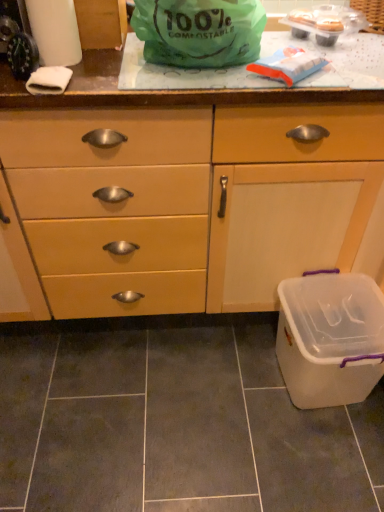
The width and height of the screenshot is (384, 512). In order to click on white paper towel at upper left in this screenshot , I will do `click(55, 31)`.

Image resolution: width=384 pixels, height=512 pixels. Find the location of `white plastic container at lower right`. white plastic container at lower right is located at coordinates (330, 338).

This screenshot has height=512, width=384. Describe the element at coordinates (194, 203) in the screenshot. I see `matte wood cabinet at center` at that location.

What are the coordinates of `green compostable bag at upper center` in the screenshot? It's located at (199, 31).

Is white plastic container at lower right at the left side of green compostable bag at upper center?

Incorrect, white plastic container at lower right is not on the left side of green compostable bag at upper center.

How much distance is there between white plastic container at lower right and green compostable bag at upper center?

A distance of 30.82 inches exists between white plastic container at lower right and green compostable bag at upper center.

Considering the sizes of objects white plastic container at lower right and green compostable bag at upper center in the image provided, who is taller, white plastic container at lower right or green compostable bag at upper center?

Standing taller between the two is white plastic container at lower right.

Image resolution: width=384 pixels, height=512 pixels. What are the coordinates of `plastic bag to the left of matte wood cabinet at center` in the screenshot? It's located at (199, 31).

Could you tell me if matte wood cabinet at center is facing green compostable bag at upper center?

No, matte wood cabinet at center is not aimed at green compostable bag at upper center.

From the picture: Is matte wood cabinet at center closer to camera compared to green compostable bag at upper center?

No, matte wood cabinet at center is further to the viewer.

Considering the relative positions of white paper towel at upper left and white plastic container at lower right in the image provided, is white paper towel at upper left to the left or to the right of white plastic container at lower right?

In the image, white paper towel at upper left appears on the left side of white plastic container at lower right.

Locate an element on the screen. paper towel that appears in front of the white plastic container at lower right is located at coordinates (55, 31).

How many degrees apart are the facing directions of white paper towel at upper left and white plastic container at lower right?

The angular difference between white paper towel at upper left and white plastic container at lower right is 86.2 degrees.

From a real-world perspective, is white paper towel at upper left physically below white plastic container at lower right?

Actually, white paper towel at upper left is physically above white plastic container at lower right in the real world.

Is green compostable bag at upper center completely or partially outside of matte wood cabinet at center?

Yes, green compostable bag at upper center is outside of matte wood cabinet at center.

Is green compostable bag at upper center touching matte wood cabinet at center?

No, green compostable bag at upper center is not with matte wood cabinet at center.

From the image's perspective, is green compostable bag at upper center under matte wood cabinet at center?

No.

Does point (161, 57) appear closer or farther from the camera than point (241, 311)?

Point (161, 57) is positioned closer to the camera compared to point (241, 311).

Is matte wood cabinet at center with white plastic container at lower right?

No.

Is matte wood cabinet at center located outside white plastic container at lower right?

Yes.

Considering the positions of objects matte wood cabinet at center and white plastic container at lower right in the image provided, who is more to the right, matte wood cabinet at center or white plastic container at lower right?

A: white plastic container at lower right is more to the right.

From the image's perspective, which object appears higher, matte wood cabinet at center or white plastic container at lower right?

matte wood cabinet at center.

Would you say white plastic container at lower right is to the left or to the right of matte wood cabinet at center in the picture?

Based on their positions, white plastic container at lower right is located to the right of matte wood cabinet at center.

From the image's perspective, is white plastic container at lower right positioned above or below matte wood cabinet at center?

white plastic container at lower right is situated lower than matte wood cabinet at center in the image.

From the picture: Is white plastic container at lower right oriented away from matte wood cabinet at center?

No, matte wood cabinet at center is not at the back of white plastic container at lower right.

From a real-world perspective, between white plastic container at lower right and matte wood cabinet at center, who is vertically higher?

In real-world perspective, matte wood cabinet at center is above.

Based on their sizes in the image, would you say white paper towel at upper left is bigger or smaller than matte wood cabinet at center?

In the image, white paper towel at upper left appears to be smaller than matte wood cabinet at center.

Is white paper towel at upper left closer to the viewer compared to matte wood cabinet at center?

No, white paper towel at upper left is further to the viewer.

Which is in front, point (33, 22) or point (67, 312)?

The point (33, 22) is more forward.

In the image, there is a green compostable bag at upper center. At what (x,y) coordinates should I click in order to perform the action: click on recycling bin below it (from the image's perspective). Please return your answer as a coordinate pair (x, y). The height and width of the screenshot is (512, 384). Looking at the image, I should click on (330, 338).

The image size is (384, 512). What are the coordinates of `plastic bag lying above the matte wood cabinet at center (from the image's perspective)` in the screenshot? It's located at (199, 31).

Looking at the image, which one is located further to white plastic container at lower right, white paper towel at upper left or matte wood cabinet at center?

white paper towel at upper left.

Which object lies further to the anchor point white plastic container at lower right, green compostable bag at upper center or white paper towel at upper left?

white paper towel at upper left is positioned further to the anchor white plastic container at lower right.

Looking at the image, which one is located closer to white paper towel at upper left, matte wood cabinet at center or green compostable bag at upper center?

green compostable bag at upper center.

Consider the image. Based on their spatial positions, is matte wood cabinet at center or white paper towel at upper left closer to white plastic container at lower right?

matte wood cabinet at center is closer to white plastic container at lower right.

Which object lies further to the anchor point green compostable bag at upper center, matte wood cabinet at center or white paper towel at upper left?

matte wood cabinet at center is further to green compostable bag at upper center.

Estimate the real-world distances between objects in this image. Which object is closer to white paper towel at upper left, matte wood cabinet at center or white plastic container at lower right?

matte wood cabinet at center is closer to white paper towel at upper left.

Estimate the real-world distances between objects in this image. Which object is closer to green compostable bag at upper center, white paper towel at upper left or white plastic container at lower right?

Based on the image, white paper towel at upper left appears to be nearer to green compostable bag at upper center.

When comparing their distances from matte wood cabinet at center, does white plastic container at lower right or white paper towel at upper left seem closer?

white plastic container at lower right lies closer to matte wood cabinet at center than the other object.

You are a GUI agent. You are given a task and a screenshot of the screen. Output one action in this format:
    pyautogui.click(x=<x>, y=<y>)
    Task: Click on the plastic bag between white paper towel at upper left and matte wood cabinet at center from left to right
    This screenshot has width=384, height=512.
    Given the screenshot: What is the action you would take?
    pyautogui.click(x=199, y=31)

Where is `cabinetry that lies between white paper towel at upper left and white plastic container at lower right from top to bottom`? cabinetry that lies between white paper towel at upper left and white plastic container at lower right from top to bottom is located at coordinates (194, 203).

This screenshot has height=512, width=384. I want to click on cabinetry between green compostable bag at upper center and white plastic container at lower right vertically, so point(194,203).

Locate an element on the screen. This screenshot has width=384, height=512. plastic bag between white paper towel at upper left and white plastic container at lower right vertically is located at coordinates (199, 31).